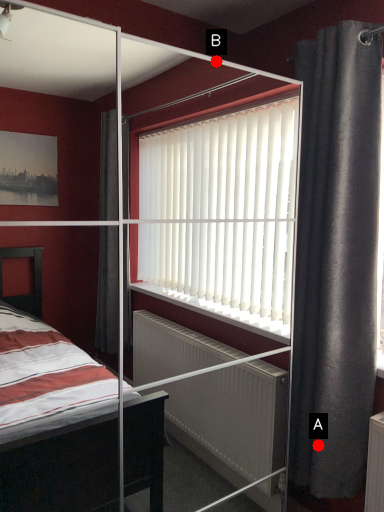
Question: Two points are circled on the image, labeled by A and B beside each circle. Which point is farther from the camera taking this photo?

Choices:
 (A) A is further
 (B) B is further

Answer: (B)